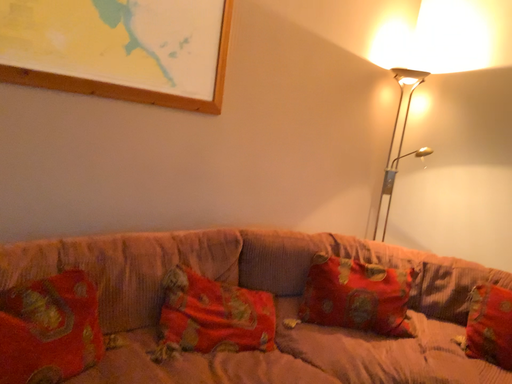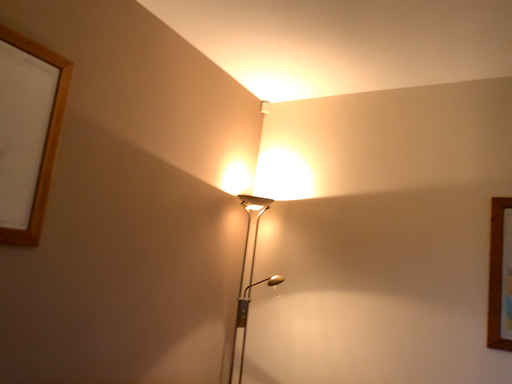
Question: How did the camera likely rotate when shooting the video?

Choices:
 (A) rotated upward
 (B) rotated downward

Answer: (A)